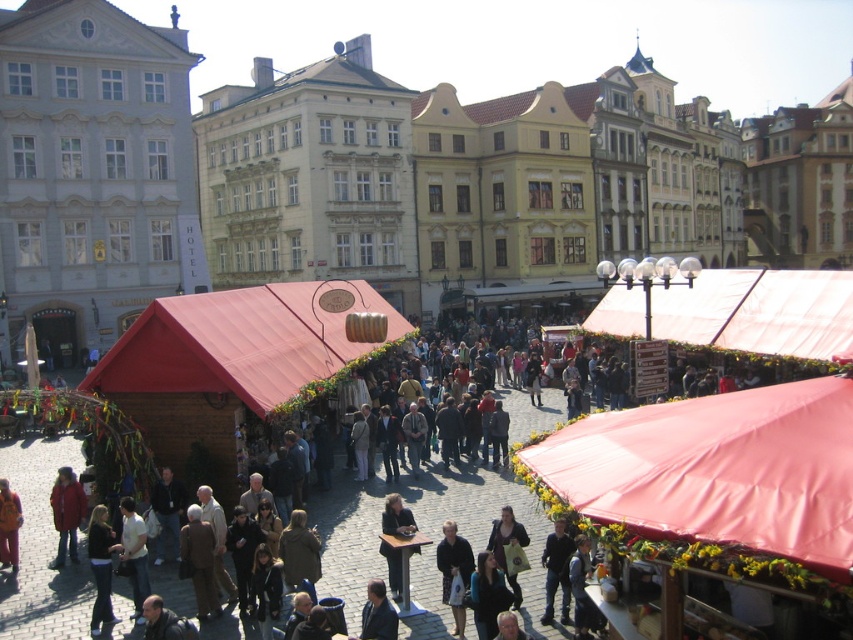
Who is taller, matte red canopy at center right or dark gray fabric jacket at center?

matte red canopy at center right

Is point (792, 291) in front of point (399, 568)?

No, it is not.

At what (x,y) coordinates should I click in order to perform the action: click on matte red canopy at center right. Please return your answer as a coordinate pair (x, y). The height and width of the screenshot is (640, 853). Looking at the image, I should click on (758, 310).

In the scene shown: Is dark blue jeans at lower left positioned in front of red wool coat at lower left?

Yes, dark blue jeans at lower left is in front of red wool coat at lower left.

Is dark blue jeans at lower left above red wool coat at lower left?

No.

Find the location of a particular element. The image size is (853, 640). dark blue jeans at lower left is located at coordinates (100, 566).

This screenshot has height=640, width=853. In order to click on dark blue jeans at lower left in this screenshot , I will do `click(100, 566)`.

Does red fabric canopy at center have a lesser width compared to light brown leather jacket at lower left?

In fact, red fabric canopy at center might be wider than light brown leather jacket at lower left.

Between red fabric canopy at center and light brown leather jacket at lower left, which one has less height?

With less height is light brown leather jacket at lower left.

Which is behind, point (775, 545) or point (135, 589)?

Point (135, 589)

Locate an element on the screen. The width and height of the screenshot is (853, 640). red fabric canopy at center is located at coordinates (718, 468).